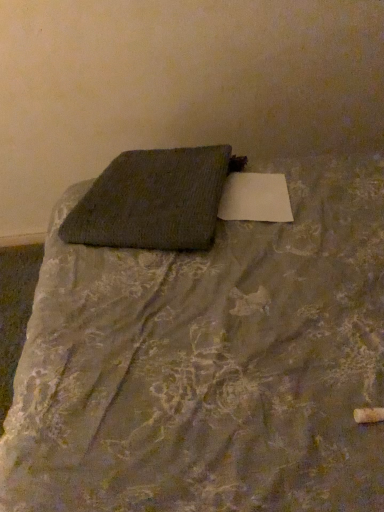
The width and height of the screenshot is (384, 512). Describe the element at coordinates (210, 362) in the screenshot. I see `textured gray fabric at center` at that location.

This screenshot has width=384, height=512. In order to click on textured gray fabric at center in this screenshot , I will do `click(210, 362)`.

Locate an element on the screen. This screenshot has width=384, height=512. textured gray pillow at center is located at coordinates (152, 201).

The height and width of the screenshot is (512, 384). What do you see at coordinates (152, 201) in the screenshot?
I see `textured gray pillow at center` at bounding box center [152, 201].

Measure the distance between point (x=144, y=198) and camera.

The distance of point (x=144, y=198) from camera is 3.71 feet.

This screenshot has width=384, height=512. In order to click on textured gray fabric at center in this screenshot , I will do `click(210, 362)`.

Which object is positioned more to the left, textured gray pillow at center or textured gray fabric at center?

Positioned to the left is textured gray pillow at center.

Which object is more forward, textured gray pillow at center or textured gray fabric at center?

Positioned in front is textured gray fabric at center.

Does point (142, 194) appear closer or farther from the camera than point (95, 395)?

Point (142, 194).

From the image's perspective, between textured gray pillow at center and textured gray fabric at center, who is located below?

textured gray fabric at center is shown below in the image.

From a real-world perspective, is textured gray pillow at center over textured gray fabric at center?

Yes.

Based on the photo, which object is wider, textured gray pillow at center or textured gray fabric at center?

textured gray fabric at center is wider.

From their relative heights in the image, would you say textured gray pillow at center is taller or shorter than textured gray fabric at center?

In the image, textured gray pillow at center appears to be shorter than textured gray fabric at center.

Based on their sizes in the image, would you say textured gray pillow at center is bigger or smaller than textured gray fabric at center?

Considering their sizes, textured gray pillow at center takes up less space than textured gray fabric at center.

Is textured gray pillow at center located outside textured gray fabric at center?

No, textured gray pillow at center is inside textured gray fabric at center's boundary.

Does textured gray pillow at center touch textured gray fabric at center?

No.

Is textured gray pillow at center oriented away from textured gray fabric at center?

Yes, textured gray pillow at center is positioned with its back facing textured gray fabric at center.

What's the angular difference between textured gray pillow at center and textured gray fabric at center's facing directions?

The facing directions of textured gray pillow at center and textured gray fabric at center are 17.1 degrees apart.

Image resolution: width=384 pixels, height=512 pixels. Find the location of `bed in front of the textured gray pillow at center`. bed in front of the textured gray pillow at center is located at coordinates (210, 362).

Considering the relative positions of textured gray fabric at center and textured gray pillow at center in the image provided, is textured gray fabric at center to the left or to the right of textured gray pillow at center?

Based on their positions, textured gray fabric at center is located to the right of textured gray pillow at center.

Between textured gray fabric at center and textured gray pillow at center, which one is positioned in front?

textured gray fabric at center is in front.

Does point (295, 430) lie behind point (203, 230)?

That is False.

From the image's perspective, which one is positioned higher, textured gray fabric at center or textured gray pillow at center?

From the image's view, textured gray pillow at center is above.

From a real-world perspective, is textured gray fabric at center physically located above or below textured gray pillow at center?

In terms of real-world spatial position, textured gray fabric at center is below textured gray pillow at center.

In terms of width, does textured gray fabric at center look wider or thinner when compared to textured gray pillow at center?

Considering their sizes, textured gray fabric at center looks broader than textured gray pillow at center.

From the picture: Considering the relative sizes of textured gray fabric at center and textured gray pillow at center in the image provided, is textured gray fabric at center taller than textured gray pillow at center?

Correct, textured gray fabric at center is much taller as textured gray pillow at center.

Is textured gray fabric at center smaller than textured gray pillow at center?

Actually, textured gray fabric at center might be larger than textured gray pillow at center.

Does textured gray fabric at center contain textured gray pillow at center?

Indeed, textured gray pillow at center is located within textured gray fabric at center.

Does textured gray fabric at center touch textured gray pillow at center?

No, textured gray fabric at center is not beside textured gray pillow at center.

Is textured gray fabric at center aimed at textured gray pillow at center?

Yes, textured gray fabric at center faces towards textured gray pillow at center.

How different are the orientations of textured gray fabric at center and textured gray pillow at center in degrees?

There is a 17.1-degree angle between the facing directions of textured gray fabric at center and textured gray pillow at center.

Image resolution: width=384 pixels, height=512 pixels. I want to click on bed in front of the textured gray pillow at center, so click(210, 362).

You are a GUI agent. You are given a task and a screenshot of the screen. Output one action in this format:
    pyautogui.click(x=<x>, y=<y>)
    Task: Click on the pillow above the textured gray fabric at center (from a real-world perspective)
    The height and width of the screenshot is (512, 384).
    Given the screenshot: What is the action you would take?
    pyautogui.click(x=152, y=201)

I want to click on bed located on the right of textured gray pillow at center, so click(210, 362).